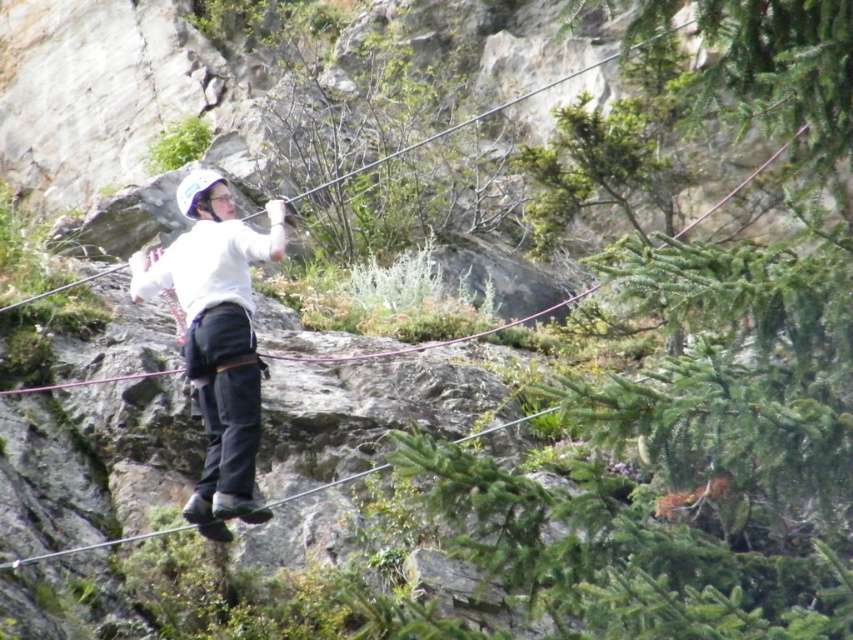
You are standing at the base of the cliff and want to reach the point marked at coordinates [619,269]. The safety rope you have is 10 meters long. Can you safely reach that point with your current rope?

The point at coordinates [619,269] is 11.50 meters away from the viewer. Since the safety rope is only 10 meters long, it is not long enough to safely reach that point.

Consider the image. You are a photographer trying to capture a climber and the surrounding environment. You notice the green leafy tree at center and the white matte helmet at center. Which object would you focus on to ensure the climber is in the foreground while still including the tree in the background?

The green leafy tree at center is taller than the white matte helmet at center, so focusing on the white matte helmet at center would place the climber in the foreground with the tree visible in the background.

You are a climber looking at the two points marked on the cliff face. Which point is closer to you, the climber, when facing the cliff? The points are labeled as point 1 at coordinates (819, 276) and point 2 at coordinates (187, 368).

Point 1 at coordinates (819, 276) is in front of point 2 at coordinates (187, 368), so it is closer to you as the climber facing the cliff.